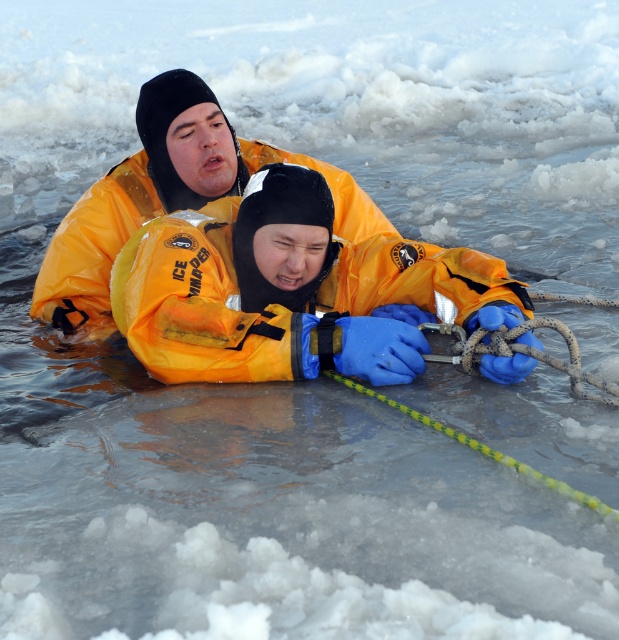
You are an ice safety instructor assessing the equipment setup in the training exercise. The orange waterproof jacket at center and the yellow matte life jacket at upper center are both visible. Which piece of equipment takes up more space in the scene?

The yellow matte life jacket at upper center takes up more space in the scene because the orange waterproof jacket at center occupies less space than it.

You are a rescue team member trying to locate the orange waterproof jacket at center in the image. According to the coordinates, where exactly is it positioned?

The orange waterproof jacket at center is located at the coordinates point (x=197, y=305).

Based on the photo, you are an ice rescue instructor observing this training scenario. You notice a point labeled with coordinates in the scene. What object is located at point (197, 305)?

The orange waterproof jacket at center is located at point (197, 305).